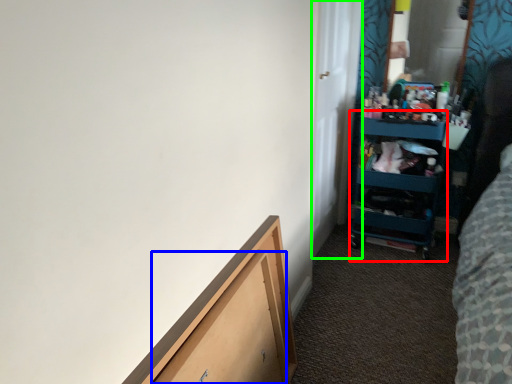
Question: Estimate the real-world distances between objects in this image. Which object is farther from cabinet (highlighted by a red box), drawer (highlighted by a blue box) or door (highlighted by a green box)?

Choices:
 (A) drawer
 (B) door

Answer: (A)